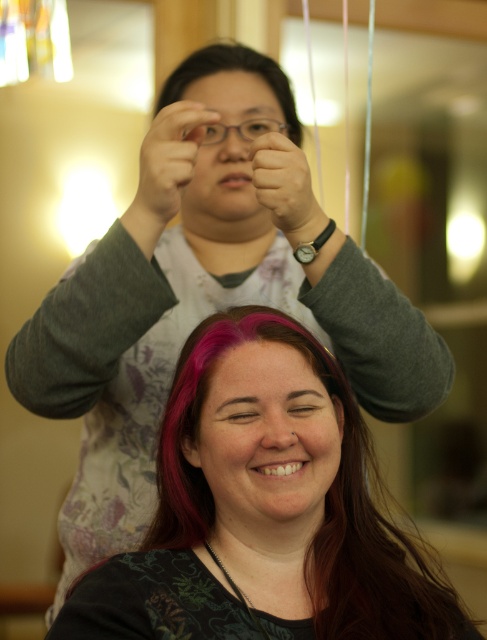
Who is lower down, shiny pink hair at center or matte black eye at center?

Positioned lower is shiny pink hair at center.

The image size is (487, 640). Find the location of `shiny pink hair at center`. shiny pink hair at center is located at coordinates (262, 513).

Does matte gray hand at center have a greater height compared to matte black eye at center?

Indeed, matte gray hand at center has a greater height compared to matte black eye at center.

Is matte gray hand at center wider than matte black eye at center?

Yes, matte gray hand at center is wider than matte black eye at center.

Is point (314, 232) positioned before point (311, 396)?

That is False.

Image resolution: width=487 pixels, height=640 pixels. Identify the location of matte gray hand at center. (285, 188).

Can you confirm if shiny pink hair at center is positioned to the right of purple hair at upper center?

Correct, you'll find shiny pink hair at center to the right of purple hair at upper center.

Does point (374, 592) lie behind point (194, 68)?

No, it is in front of (194, 68).

Where is `shiny pink hair at center`? The image size is (487, 640). shiny pink hair at center is located at coordinates (262, 513).